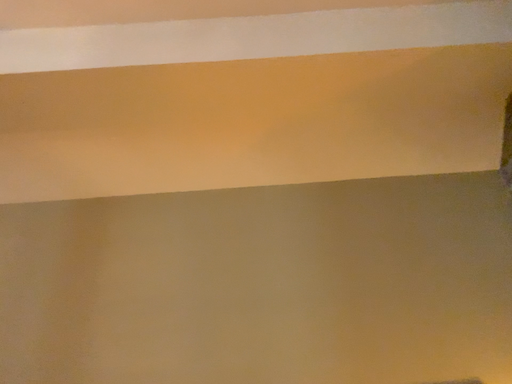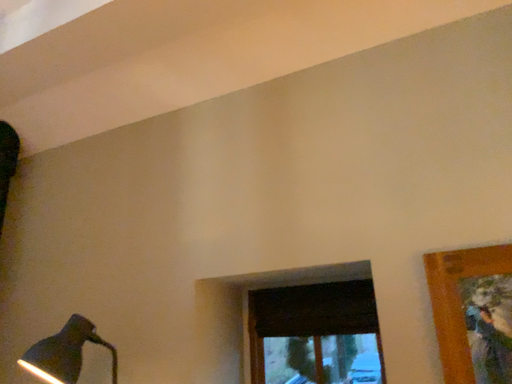
Question: Which way did the camera rotate in the video?

Choices:
 (A) rotated right
 (B) rotated left

Answer: (B)